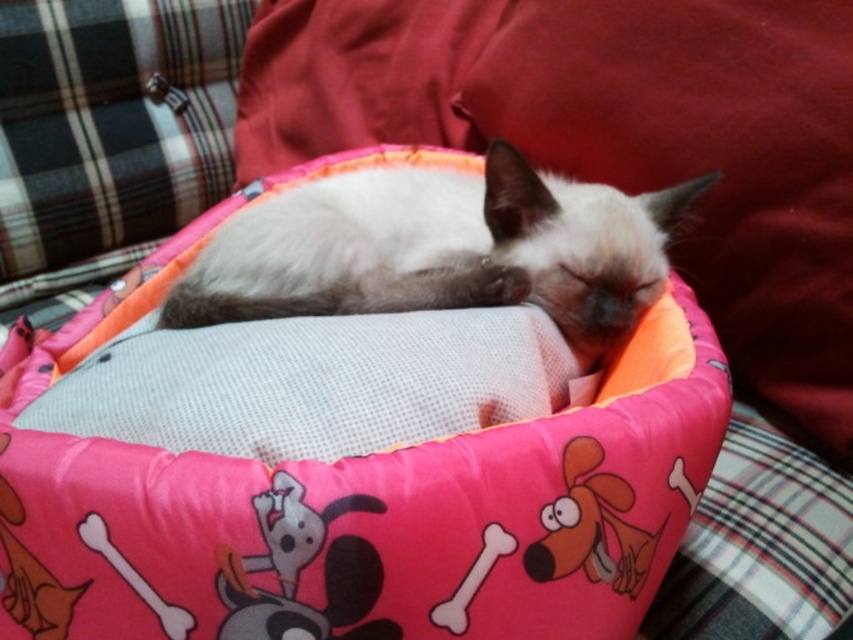
Question: Can you confirm if pink fabric bean bag chair at center is smaller than silky white cat at center?

Choices:
 (A) yes
 (B) no

Answer: (B)

Question: Can you confirm if pink fabric bean bag chair at center is positioned to the right of silky white cat at center?

Choices:
 (A) no
 (B) yes

Answer: (A)

Question: Among these objects, which one is farthest from the camera?

Choices:
 (A) silky white cat at center
 (B) pink fabric bean bag chair at center

Answer: (A)

Question: Can you confirm if pink fabric bean bag chair at center is positioned to the right of silky white cat at center?

Choices:
 (A) yes
 (B) no

Answer: (B)

Question: Among these objects, which one is farthest from the camera?

Choices:
 (A) pink fabric bean bag chair at center
 (B) silky white cat at center

Answer: (B)